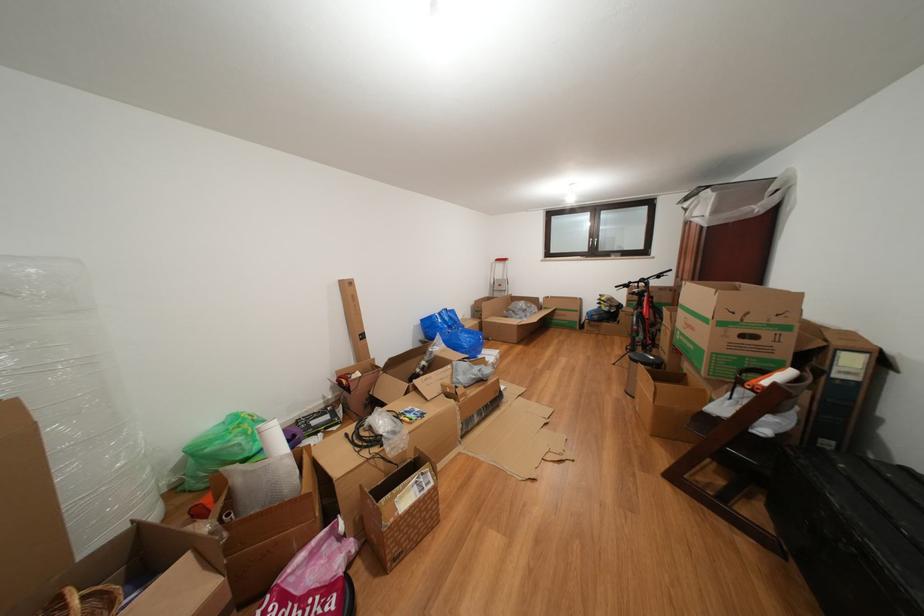
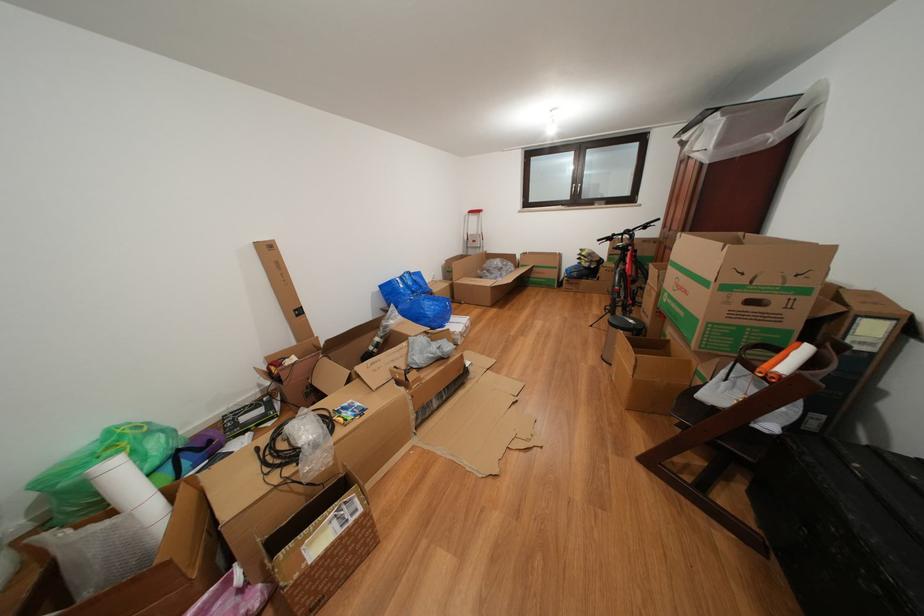
Find the pixel in the second image that matches [700,334] in the first image.

(694, 297)